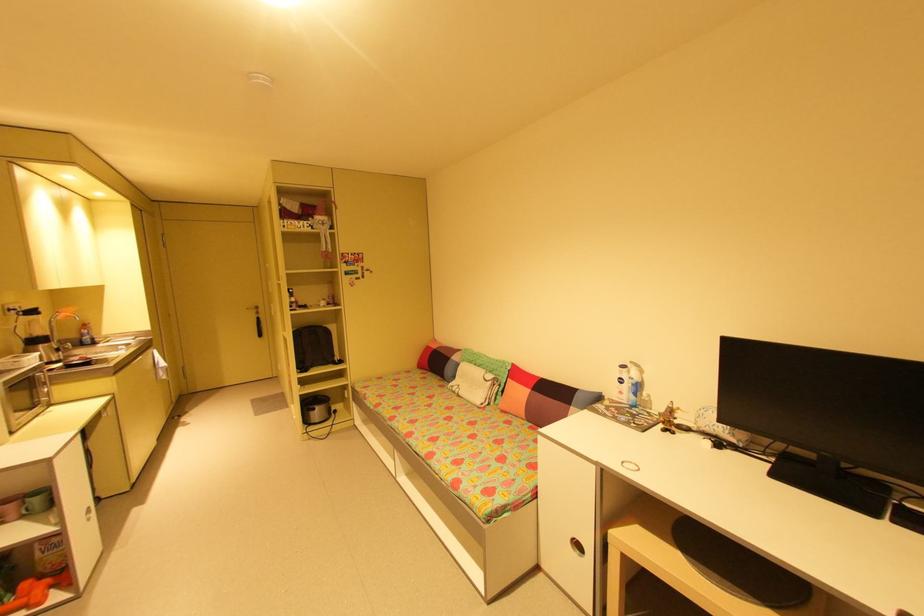
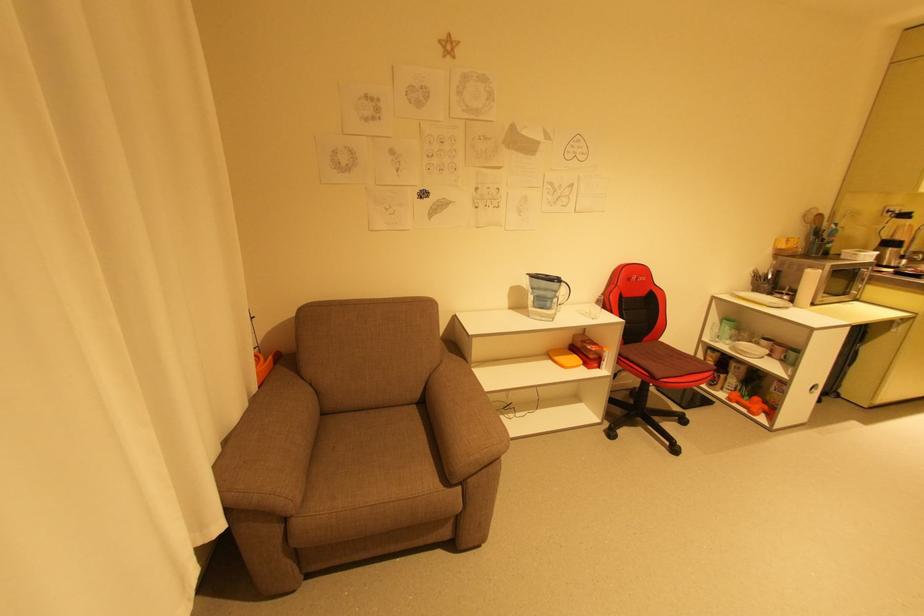
How did the camera likely rotate?

The camera's rotation is toward left-down.